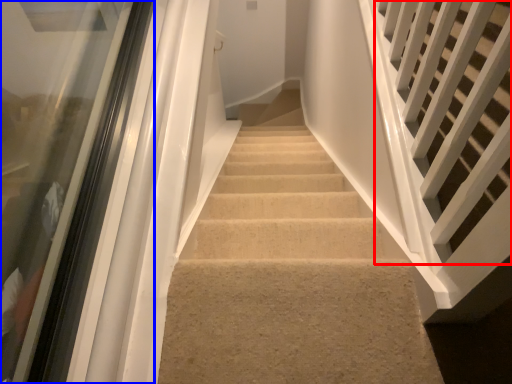
Question: Which object is further to the camera taking this photo, stairs (highlighted by a red box) or glass door (highlighted by a blue box)?

Choices:
 (A) stairs
 (B) glass door

Answer: (B)